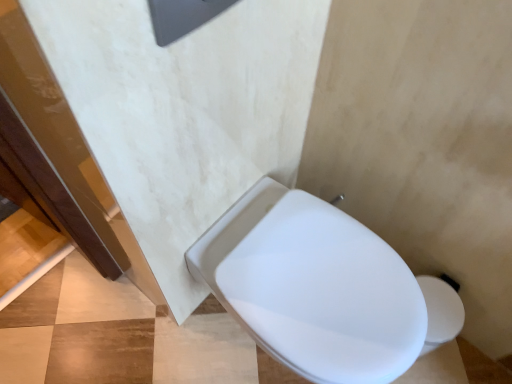
In order to click on white glossy toilet at lower right in this screenshot , I will do `click(116, 336)`.

Describe the element at coordinates (116, 336) in the screenshot. I see `white glossy toilet at lower right` at that location.

This screenshot has width=512, height=384. I want to click on white glossy toilet at center, so click(x=313, y=286).

This screenshot has height=384, width=512. What do you see at coordinates (313, 286) in the screenshot?
I see `white glossy toilet at center` at bounding box center [313, 286].

In order to face white glossy toilet at center, should I rotate leftwards or rightwards?

You should rotate right by 6.280 degrees.

Where is `white glossy toilet at lower right`? white glossy toilet at lower right is located at coordinates (116, 336).

Which object is positioned more to the left, white glossy toilet at center or white glossy toilet at lower right?

Positioned to the left is white glossy toilet at lower right.

Relative to white glossy toilet at lower right, is white glossy toilet at center in front or behind?

white glossy toilet at center is positioned closer to the viewer than white glossy toilet at lower right.

Between point (219, 249) and point (36, 326), which one is positioned behind?

The point (36, 326) is farther.

From the image's perspective, is white glossy toilet at center beneath white glossy toilet at lower right?

No, from the image's perspective, white glossy toilet at center is not beneath white glossy toilet at lower right.

From a real-world perspective, is white glossy toilet at center positioned above or below white glossy toilet at lower right?

white glossy toilet at center is situated higher than white glossy toilet at lower right in the real world.

Which object is thinner, white glossy toilet at center or white glossy toilet at lower right?

Thinner between the two is white glossy toilet at center.

Between white glossy toilet at center and white glossy toilet at lower right, which one has less height?

white glossy toilet at lower right.

Who is bigger, white glossy toilet at center or white glossy toilet at lower right?

Bigger between the two is white glossy toilet at center.

Is white glossy toilet at center inside or outside of white glossy toilet at lower right?

white glossy toilet at center is not inside white glossy toilet at lower right, it's outside.

Is white glossy toilet at center far from white glossy toilet at lower right?

No, white glossy toilet at center is in close proximity to white glossy toilet at lower right.

Could you tell me if white glossy toilet at center is facing white glossy toilet at lower right?

No, white glossy toilet at center is not aimed at white glossy toilet at lower right.

How distant is white glossy toilet at center from white glossy toilet at lower right?

white glossy toilet at center and white glossy toilet at lower right are 18.06 inches apart.

You are a GUI agent. You are given a task and a screenshot of the screen. Output one action in this format:
    pyautogui.click(x=<x>, y=<y>)
    Task: Click on the toilet on the right of white glossy toilet at lower right
    The width and height of the screenshot is (512, 384).
    Given the screenshot: What is the action you would take?
    pyautogui.click(x=313, y=286)

Consider the image. Considering the relative positions of white glossy toilet at lower right and white glossy toilet at center in the image provided, is white glossy toilet at lower right to the left or to the right of white glossy toilet at center?

white glossy toilet at lower right is positioned on white glossy toilet at center's left side.

Is white glossy toilet at lower right in front of white glossy toilet at center?

No, white glossy toilet at lower right is behind white glossy toilet at center.

Considering the positions of point (64, 326) and point (370, 276), is point (64, 326) closer or farther from the camera than point (370, 276)?

Point (64, 326) is farther from the camera than point (370, 276).

From the image's perspective, is white glossy toilet at lower right over white glossy toilet at center?

No.

From a real-world perspective, who is located higher, white glossy toilet at lower right or white glossy toilet at center?

From a 3D spatial view, white glossy toilet at center is above.

Can you confirm if white glossy toilet at lower right is wider than white glossy toilet at center?

Indeed, white glossy toilet at lower right has a greater width compared to white glossy toilet at center.

Looking at this image, is white glossy toilet at lower right taller or shorter than white glossy toilet at center?

Clearly, white glossy toilet at lower right is shorter compared to white glossy toilet at center.

Considering the sizes of objects white glossy toilet at lower right and white glossy toilet at center in the image provided, who is bigger, white glossy toilet at lower right or white glossy toilet at center?

white glossy toilet at center is bigger.

Is white glossy toilet at lower right located outside white glossy toilet at center?

white glossy toilet at lower right lies outside white glossy toilet at center's area.

Is white glossy toilet at lower right in contact with white glossy toilet at center?

No, white glossy toilet at lower right is not in contact with white glossy toilet at center.

Is white glossy toilet at lower right oriented towards white glossy toilet at center?

No.

How different are the orientations of white glossy toilet at lower right and white glossy toilet at center in degrees?

white glossy toilet at lower right and white glossy toilet at center are facing 180 degrees away from each other.

Measure the distance from white glossy toilet at lower right to white glossy toilet at center.

18.06 inches.

I want to click on toilet on the right of white glossy toilet at lower right, so click(313, 286).

This screenshot has width=512, height=384. What are the coordinates of `concrete below the white glossy toilet at center (from a real-world perspective)` in the screenshot? It's located at (116, 336).

There is a white glossy toilet at lower right. What are the coordinates of `toilet above it (from a real-world perspective)` in the screenshot? It's located at (313, 286).